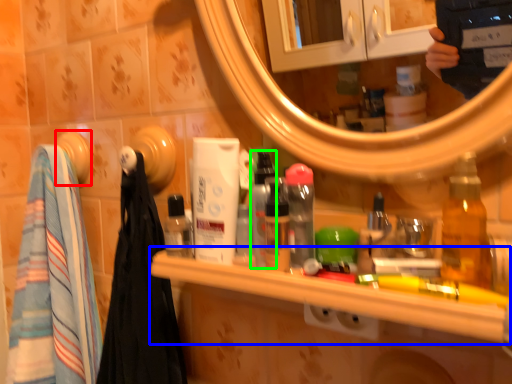
Question: Which object is positioned closest to towel bar (highlighted by a red box)? Select from counter (highlighted by a blue box) and bottle (highlighted by a green box).

Choices:
 (A) counter
 (B) bottle

Answer: (B)